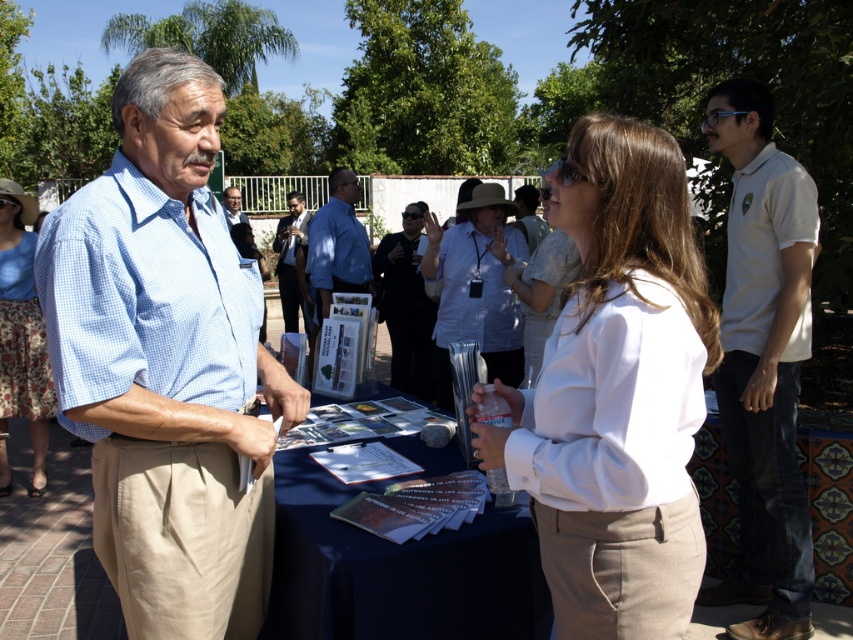
Question: Based on their relative distances, which object is farther from the light blue checkered shirt at center?

Choices:
 (A) blue checkered shirt at center
 (B) matte blue shirt at center
 (C) floral skirt at lower left
 (D) white matte shirt at center

Answer: (A)

Question: Can you confirm if white cotton blouse at center is bigger than blue shirt at center?

Choices:
 (A) yes
 (B) no

Answer: (B)

Question: Does matte blue shirt at center have a larger size compared to blue checkered shirt at center?

Choices:
 (A) yes
 (B) no

Answer: (B)

Question: Does white cotton blouse at center appear on the left side of matte blue shirt at center?

Choices:
 (A) yes
 (B) no

Answer: (B)

Question: Which of these objects is positioned closest to the white cotton polo shirt at right?

Choices:
 (A) white cotton blouse at center
 (B) floral skirt at lower left
 (C) matte blue shirt at center
 (D) blue checkered shirt at center

Answer: (A)

Question: Which point appears closest to the camera in this image?

Choices:
 (A) (633, 193)
 (B) (236, 195)
 (C) (473, 234)
 (D) (408, 320)

Answer: (A)